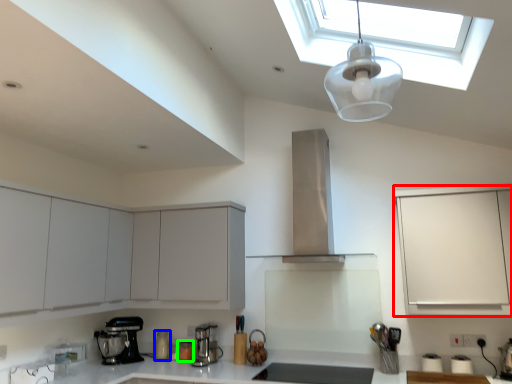
Question: Which object is positioned closest to cabinetry (highlighted by a red box)? Select from kitchen appliance (highlighted by a blue box) and kitchen appliance (highlighted by a green box).

Choices:
 (A) kitchen appliance
 (B) kitchen appliance

Answer: (B)